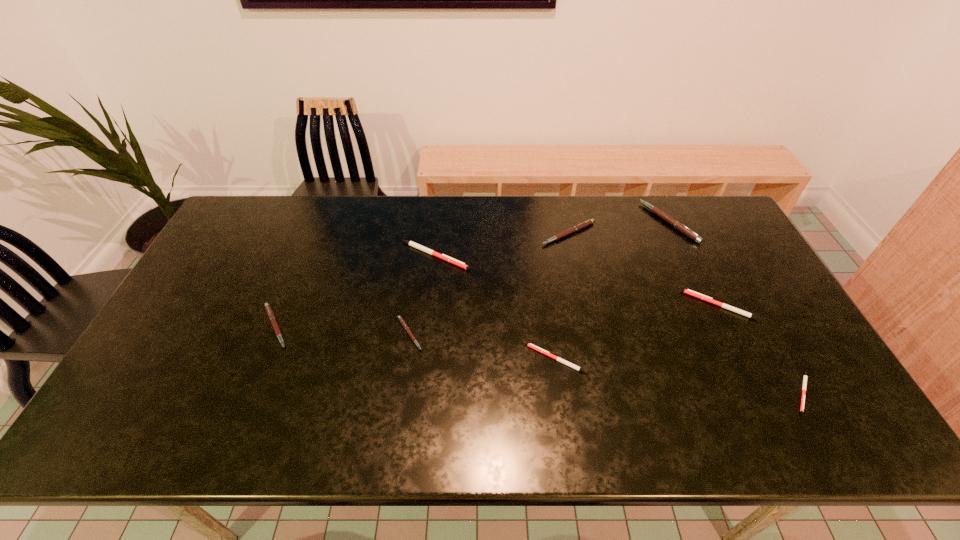
Choose which pink pen is the third nearest neighbor to the leftmost pen. Please provide its 2D coordinates. Your answer should be formatted as a tuple, i.e. [(x, y)], where the tuple contains the x and y coordinates of a point satisfying the conditions above.

[(682, 228)]

Image resolution: width=960 pixels, height=540 pixels. In order to click on white pen that is the fourth closest to the biggest pink pen in this screenshot , I will do `click(456, 262)`.

Identify the location of white pen that is the closest to the shortest object. (688, 291).

Locate an element on the screen. free point that satisfies the following two spatial constraints: 1. at the nib of the tallest pen; 2. at the nib of the second biggest pink pen is located at coordinates (674, 234).